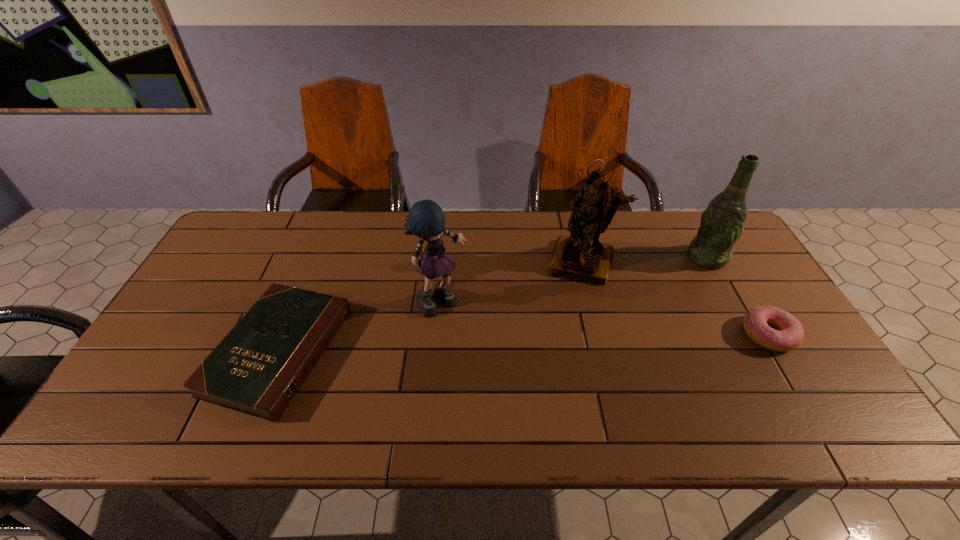
Where is `Bible`? Bible is located at coordinates (259, 366).

The image size is (960, 540). What are the coordinates of `doughnut` in the screenshot? It's located at (789, 334).

Locate an element on the screen. beer bottle is located at coordinates (722, 223).

Locate an element on the screen. rag doll is located at coordinates (426, 219).

Where is `the third object from left to right`? the third object from left to right is located at coordinates (581, 256).

Find the location of a particular element. Image resolution: width=960 pixels, height=540 pixels. free region located on the back of the leftmost object is located at coordinates (334, 212).

Locate an element on the screen. vacant space located on the left of the doughnut is located at coordinates (711, 335).

I want to click on free region located 0.080m on the surface of the beer bottle, so click(681, 277).

The image size is (960, 540). Find the location of `vacant space situated 0.190m on the surface of the beer bottle`. vacant space situated 0.190m on the surface of the beer bottle is located at coordinates [x=658, y=294].

At what (x,y) coordinates should I click in order to perform the action: click on free point located on the surface of the beer bottle. Please return your answer as a coordinate pair (x, y). The image size is (960, 540). Looking at the image, I should click on (622, 320).